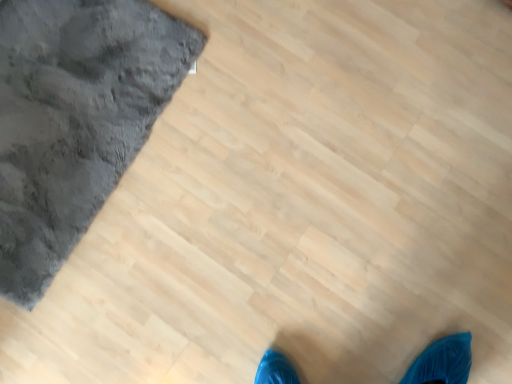
Where is `free point below dark gray plush bath mat at upper left (from a real-world perspective)`? free point below dark gray plush bath mat at upper left (from a real-world perspective) is located at coordinates 72,99.